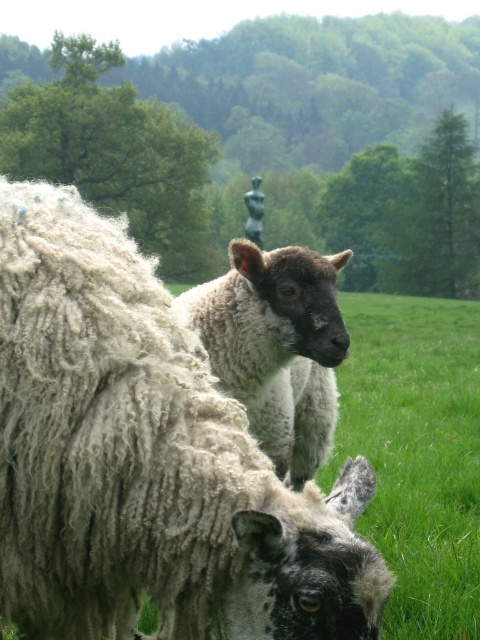
You are standing in the field looking at the curly woolen sheep at center. If you take one step forward, will you be closer than 5 feet to it?

The curly woolen sheep at center is currently 5.24 feet away from you. If you take one step forward, you would be closer than 5.24 feet, but since one step is typically about 2.5 to 3 feet, your new distance would be between 2.74 and 2.24 feet. Therefore, yes, you would be closer than 5 feet to the curly woolen sheep at center.

You are a farmer who needs to separate two animals in the field. The curly woolen sheep at center and the white woolen lamb at center are currently too close. What is the minimum distance you need to move one of them to ensure they are at least 4 feet apart?

The curly woolen sheep at center and white woolen lamb at center are currently 36.78 inches apart. Since 4 feet equals 48 inches, you need to move one of them at least 11.22 inches further away to reach the required distance of 48 inches.

You are standing at the point marked by the coordinates point (146, 460) in the image. Looking around, you see two sheep in the scene. Which sheep is directly in front of you?

Result: The curly woolen sheep at center is directly in front of you at point (146, 460).